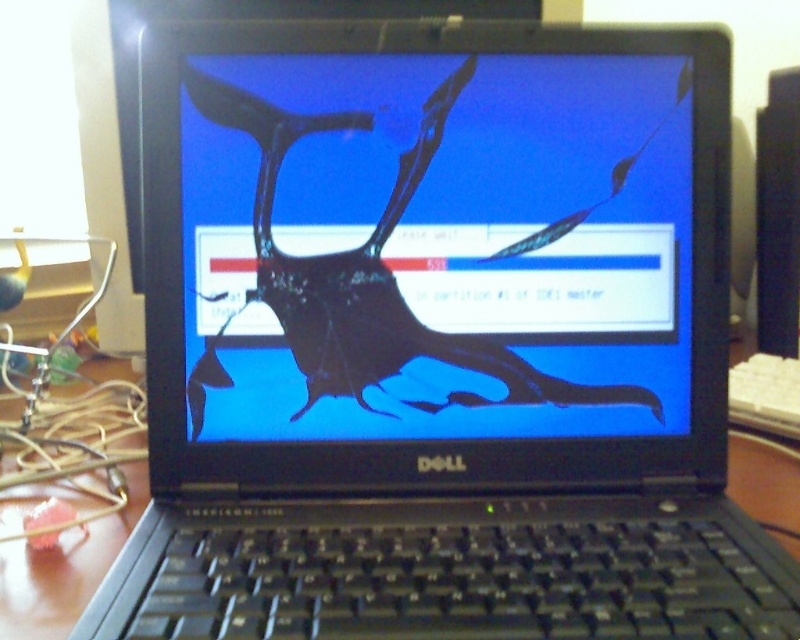
You are a technician trying to repair the Dell laptop. You need to place a protective cover between the transparent glass screen at center and the wooden table at center to prevent further damage. What is the minimum width the protective cover should be to fit between them?

The transparent glass screen at center and wooden table at center are 23.54 centimeters apart, so the protective cover should be at least 23.54 centimeters wide to fit between them.

You are a technician examining the Dell laptop with a cracked screen. You notice two points on the screen at coordinates point (612, 400) and point (784, 540). Which point is closer to you?

Point (612, 400) is closer to the viewer than point (784, 540).

Consider the image. You are organizing items on a desk and notice the transparent glass screen at center and the wooden table at center. Which item is positioned to the right side?

The transparent glass screen at center is to the right of the wooden table at center.